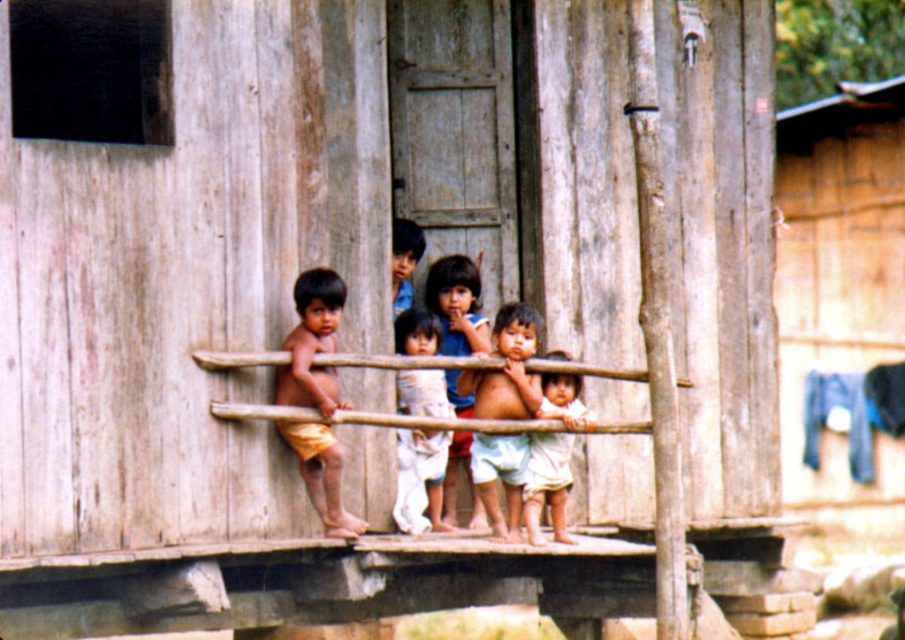
Question: Is light blue cotton shorts at center behind white cotton dress at center?

Choices:
 (A) no
 (B) yes

Answer: (A)

Question: Which of the following is the closest to the observer?

Choices:
 (A) (505, 490)
 (B) (474, 520)

Answer: (A)

Question: Which of these objects is positioned farthest from the wooden clothesline at right?

Choices:
 (A) brown skin/soft skin boy at center
 (B) light blue cotton shorts at center

Answer: (B)

Question: Among these objects, which one is nearest to the camera?

Choices:
 (A) brown skin/soft skin boy at center
 (B) white cotton dress at center

Answer: (A)

Question: Can you confirm if wooden clothesline at right is wider than white cotton dress at center?

Choices:
 (A) no
 (B) yes

Answer: (B)

Question: Is white cotton dress at center closer to the viewer compared to light beige cotton shirt at center?

Choices:
 (A) no
 (B) yes

Answer: (A)